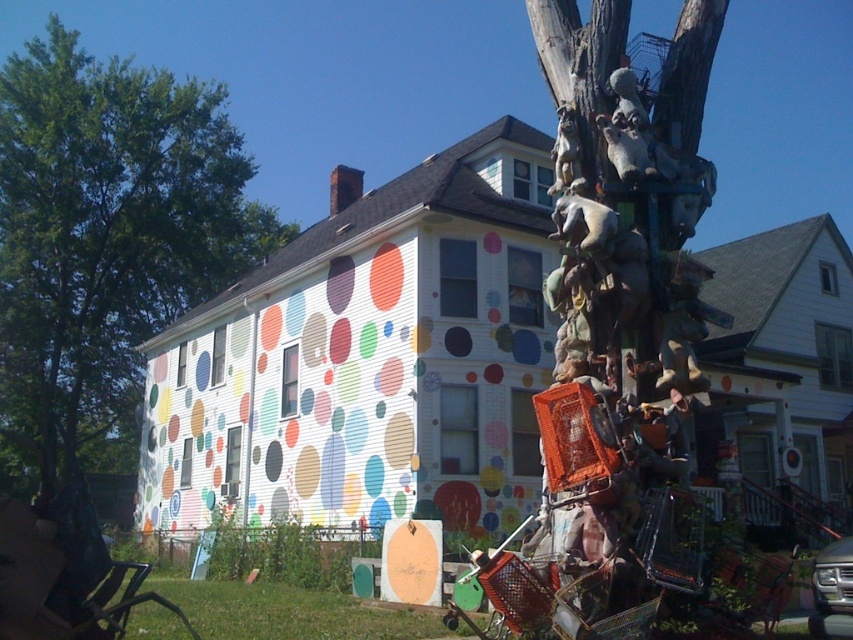
Question: Which point appears farthest from the camera in this image?

Choices:
 (A) (25, 113)
 (B) (433, 625)

Answer: (A)

Question: Is green leafy tree at upper left to the left of green grass at lower center from the viewer's perspective?

Choices:
 (A) no
 (B) yes

Answer: (B)

Question: Is green leafy tree at upper left positioned before green grass at lower center?

Choices:
 (A) no
 (B) yes

Answer: (B)

Question: Can you confirm if green leafy tree at upper left is positioned above green grass at lower center?

Choices:
 (A) no
 (B) yes

Answer: (B)

Question: Among these objects, which one is nearest to the camera?

Choices:
 (A) green leafy tree at upper left
 (B) green grass at lower center

Answer: (A)